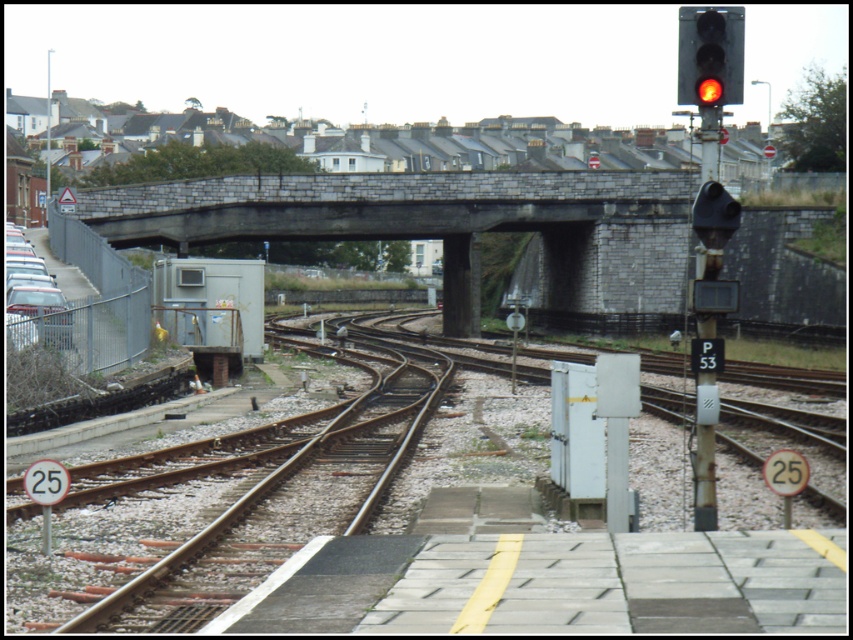
You are a pedestrian waiting at the platform with yellow tactile paving strip. You see the metal train track at center and the red glass traffic light at upper right. Which object is taller?

The red glass traffic light at upper right is taller than the metal train track at center.

You are a pedestrian waiting on the platform and want to cross the tracks safely. The metal train track at center and the red glass traffic light at upper right are in your line of sight. Which object is closer to you, the pedestrian?

The metal train track at center is closer to the viewer than the red glass traffic light at upper right, so the metal train track at center is closer to you.

You are a train engineer approaching the stone bridge at center and the red glass traffic light at upper right. Which structure will you pass under first?

The stone bridge at center is not as tall as the red glass traffic light at upper right, so you will pass under the red glass traffic light at upper right first before reaching the stone bridge at center.